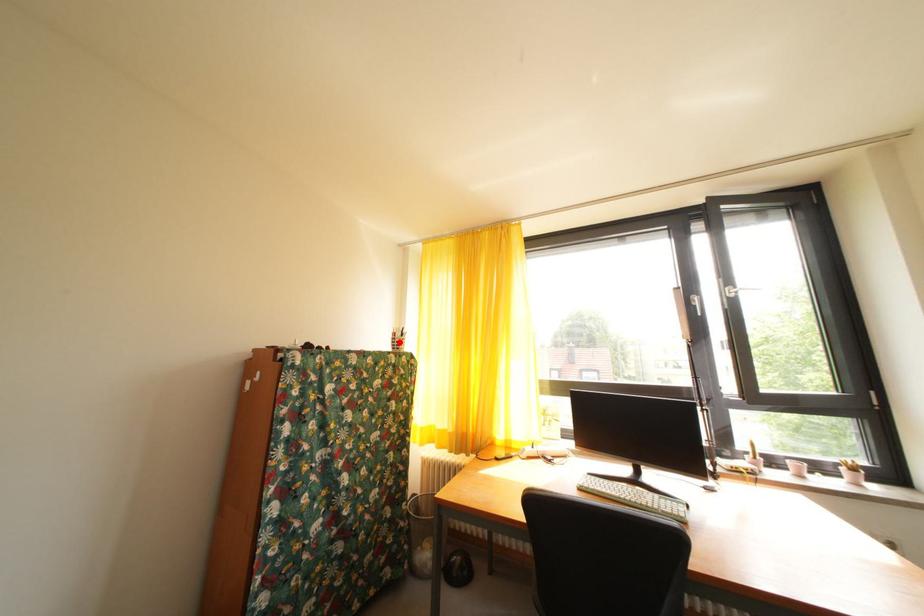
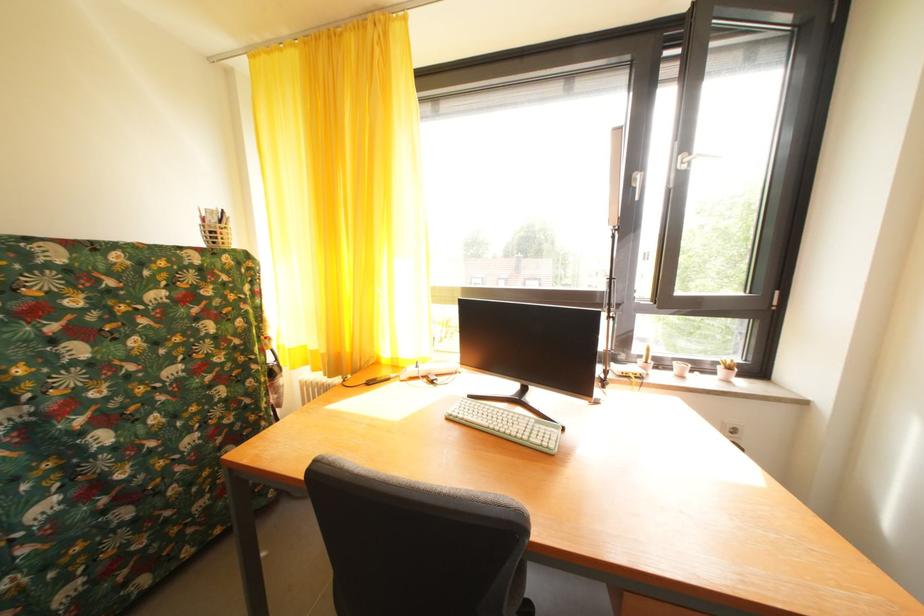
Where in the second image is the point corresponding to the highlighted location from the first image?

(209, 229)